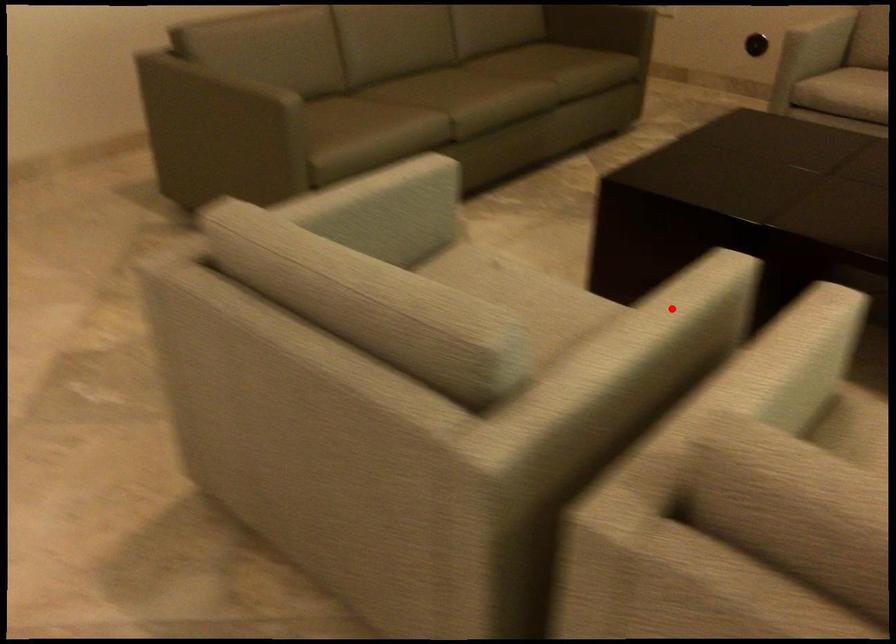
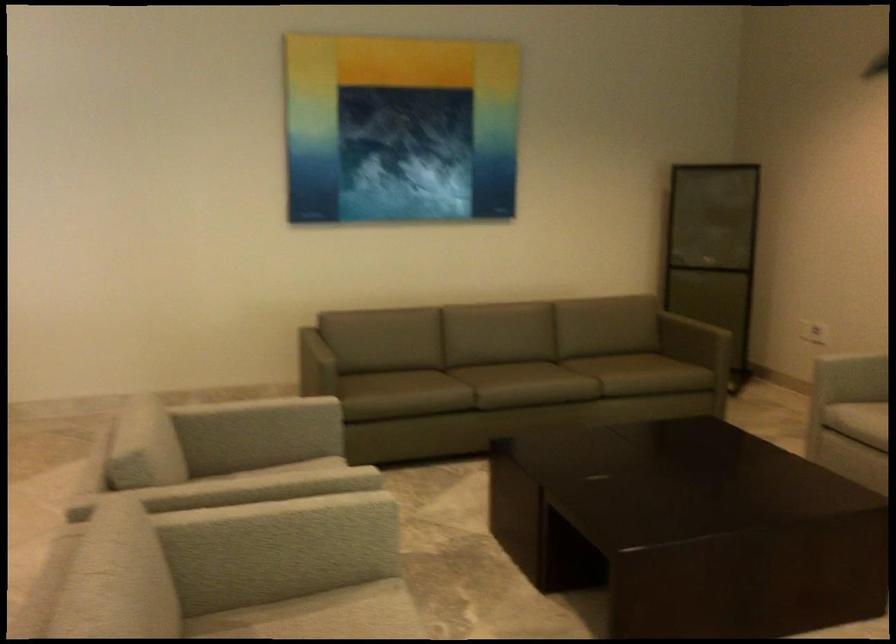
Question: I am providing you with two images of the same scene from different viewpoints. A red point is shown in image1. For the corresponding object point in image2, is it positioned nearer or farther from the camera?

Choices:
 (A) Nearer
 (B) Farther

Answer: (B)